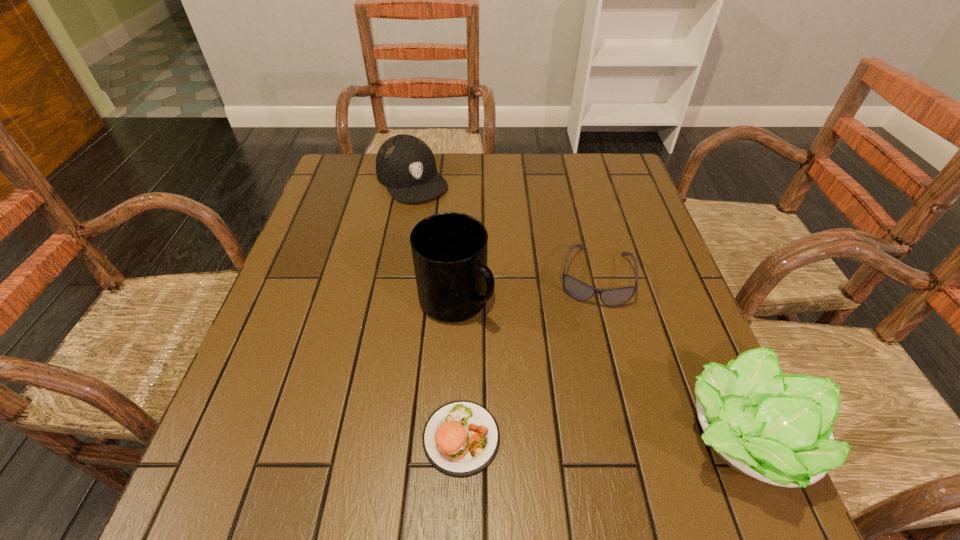
I want to click on the shortest object, so click(x=460, y=438).

The image size is (960, 540). Find the location of `lettuce`. lettuce is located at coordinates (777, 429).

This screenshot has width=960, height=540. In order to click on mug in this screenshot , I will do `click(449, 250)`.

I want to click on sunglasses, so click(x=614, y=297).

Where is `cap`? cap is located at coordinates (406, 165).

Identify the location of free spot located 0.060m on the right of the shortest object. (535, 437).

Find the location of `vacant space located 0.130m on the left of the lettuce`. vacant space located 0.130m on the left of the lettuce is located at coordinates (594, 438).

I want to click on vacant space located on the side of the tallest object with the handle, so click(x=530, y=367).

This screenshot has height=540, width=960. Identify the location of vacant space located 0.270m on the side of the tallest object with the handle. (583, 413).

The width and height of the screenshot is (960, 540). Find the location of `free space located 0.110m on the side of the tallest object with the handle`. free space located 0.110m on the side of the tallest object with the handle is located at coordinates (518, 357).